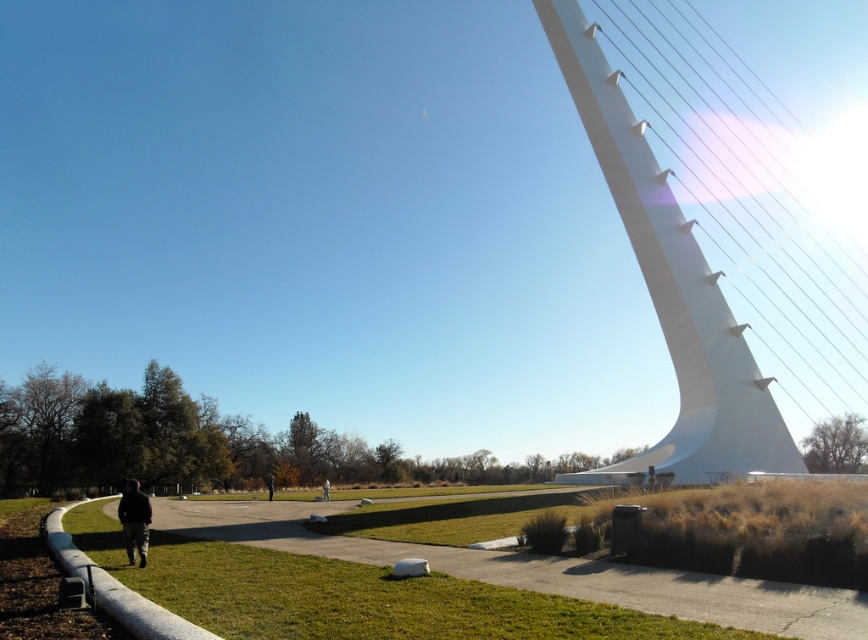
Does black fabric person at lower center have a lesser height compared to gray fabric person at center?

Correct, black fabric person at lower center is not as tall as gray fabric person at center.

The width and height of the screenshot is (868, 640). I want to click on black fabric person at lower center, so click(x=270, y=484).

Does concrete at lower left have a lesser width compared to gray fabric person at center?

Incorrect, concrete at lower left's width is not less than gray fabric person at center's.

Consider the image. Does concrete at lower left have a greater width compared to gray fabric person at center?

Yes, concrete at lower left is wider than gray fabric person at center.

Is point (544, 582) positioned behind point (321, 488)?

No.

Where is `concrete at lower left`? concrete at lower left is located at coordinates (537, 570).

Who is positioned more to the left, white smooth suspension bridge at right or black fabric person at lower center?

Positioned to the left is black fabric person at lower center.

Is point (586, 125) positioned behind point (273, 477)?

That is False.

Is point (763, 435) farther from camera compared to point (268, 488)?

No, it is not.

This screenshot has height=640, width=868. In order to click on white smooth suspension bridge at right in this screenshot , I will do `click(669, 289)`.